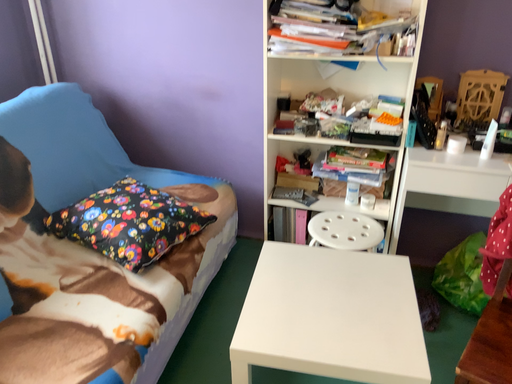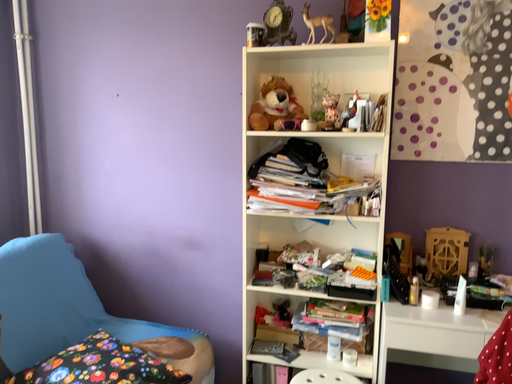
Question: Which way did the camera rotate in the video?

Choices:
 (A) rotated downward
 (B) rotated upward

Answer: (B)